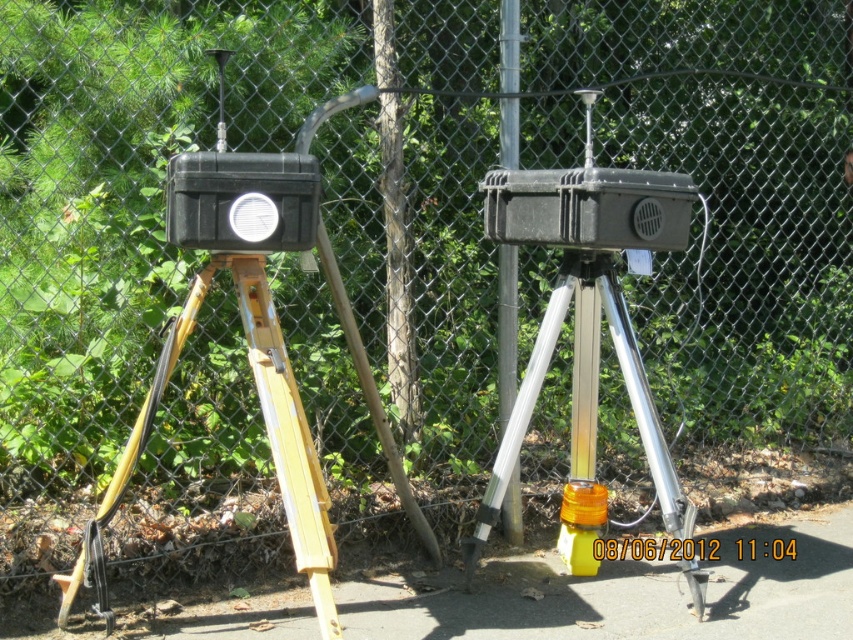
You are standing at the origin point of the coordinate system. You need to locate the brushed metal pole at center. What are its coordinates?

The coordinates of the brushed metal pole at center are at point (395, 228).

You are setting up equipment in an outdoor area and need to attach a banner to the taller object. Which object should you choose between the silver metallic tripod at center and the metallic pole at center?

The metallic pole at center is taller than the silver metallic tripod at center, so you should attach the banner to the metallic pole at center.

You are a technician inspecting the devices. You need to access the silver metallic tripod at center. Which direction should you move relative to the brushed metal pole at center to reach it?

The silver metallic tripod at center is located below the brushed metal pole at center, so you should move downward from the brushed metal pole at center to reach the silver metallic tripod at center.